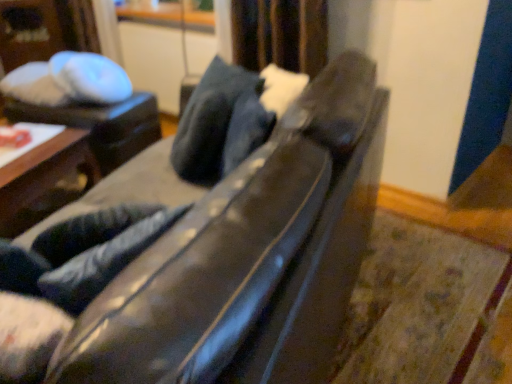
Find the location of a particular element. The image size is (512, 384). wooden table at left, which is counted as the first table, starting from the front is located at coordinates (44, 180).

What do you see at coordinates (44, 180) in the screenshot?
I see `wooden table at left, which is counted as the first table, starting from the front` at bounding box center [44, 180].

In order to face dark blue leather pillow at center, should I rotate leftwards or rightwards?

It's best to rotate left around 4.480 degrees.

In order to face white glossy table at upper left, which ranks as the 2th table in front-to-back order, should I rotate leftwards or rightwards?

Turn left approximately 21.619 degrees to face it.

Identify the location of black leather couch at center. (210, 262).

Does wooden table at left, which is counted as the first table, starting from the front, turn towards dark blue leather pillow at center?

No, wooden table at left, which is counted as the first table, starting from the front, is not facing towards dark blue leather pillow at center.

In the image, is wooden table at left, which is counted as the second table, starting from the back, on the left side or the right side of dark blue leather pillow at center?

From the image, it's evident that wooden table at left, which is counted as the second table, starting from the back, is to the left of dark blue leather pillow at center.

Considering their positions, is wooden table at left, which is counted as the first table, starting from the front, located in front of or behind dark blue leather pillow at center?

Visually, wooden table at left, which is counted as the first table, starting from the front, is located behind dark blue leather pillow at center.

Is wooden table at left, which is counted as the first table, starting from the front, turned away from satin dark blue curtain at upper center?

wooden table at left, which is counted as the first table, starting from the front, does not have its back to satin dark blue curtain at upper center.

Between wooden table at left, which is counted as the first table, starting from the front, and satin dark blue curtain at upper center, which one has more height?

Standing taller between the two is satin dark blue curtain at upper center.

From the image's perspective, between wooden table at left, which is counted as the first table, starting from the front, and satin dark blue curtain at upper center, which one is located above?

satin dark blue curtain at upper center.

Based on the photo, does wooden table at left, which is counted as the first table, starting from the front, come in front of satin dark blue curtain at upper center?

Yes, the depth of wooden table at left, which is counted as the first table, starting from the front, is less than that of satin dark blue curtain at upper center.

From the image's perspective, is satin dark blue curtain at upper center located beneath black leather couch at center?

No, from the image's perspective, satin dark blue curtain at upper center is not below black leather couch at center.

Between satin dark blue curtain at upper center and black leather couch at center, which one has larger size?

With larger size is black leather couch at center.

From a real-world perspective, is satin dark blue curtain at upper center physically located above or below black leather couch at center?

Clearly, from a real-world perspective, satin dark blue curtain at upper center is above black leather couch at center.

Is dark blue leather pillow at center smaller than satin dark blue curtain at upper center?

No, dark blue leather pillow at center is not smaller than satin dark blue curtain at upper center.

Which point is more distant from viewer, (178,135) or (303,31)?

The point (303,31) is farther from the camera.

How far apart are dark blue leather pillow at center and satin dark blue curtain at upper center?

A distance of 25.44 inches exists between dark blue leather pillow at center and satin dark blue curtain at upper center.

Consider the image. Is dark blue leather pillow at center placed right next to satin dark blue curtain at upper center?

No, dark blue leather pillow at center is not in contact with satin dark blue curtain at upper center.

Which is in front, black leather couch at center or white glossy table at upper left, the 1th table in the back-to-front sequence?

black leather couch at center is more forward.

Which of these two, black leather couch at center or white glossy table at upper left, which ranks as the 2th table in front-to-back order, stands taller?

Standing taller between the two is black leather couch at center.

Locate an element on the screen. The image size is (512, 384). studio couch that is in front of the white glossy table at upper left, the 1th table in the back-to-front sequence is located at coordinates (210, 262).

Is black leather couch at center turned away from white glossy table at upper left, which ranks as the 2th table in front-to-back order?

No.

Which is more to the left, satin dark blue curtain at upper center or wooden table at left, which is counted as the first table, starting from the front?

Positioned to the left is wooden table at left, which is counted as the first table, starting from the front.

Is satin dark blue curtain at upper center looking in the opposite direction of wooden table at left, which is counted as the first table, starting from the front?

No, wooden table at left, which is counted as the first table, starting from the front, is not at the back of satin dark blue curtain at upper center.

From a real-world perspective, is satin dark blue curtain at upper center positioned under wooden table at left, which is counted as the first table, starting from the front, based on gravity?

No.

Would you consider satin dark blue curtain at upper center to be distant from wooden table at left, which is counted as the second table, starting from the back?

satin dark blue curtain at upper center is positioned a significant distance from wooden table at left, which is counted as the second table, starting from the back.

Is white glossy table at upper left, which ranks as the 2th table in front-to-back order, smaller than black leather couch at center?

Yes.

Is white glossy table at upper left, the 1th table in the back-to-front sequence, far from black leather couch at center?

That's right, there is a large distance between white glossy table at upper left, the 1th table in the back-to-front sequence, and black leather couch at center.

From a real-world perspective, is white glossy table at upper left, the 1th table in the back-to-front sequence, on black leather couch at center?

Incorrect, from a real-world perspective, white glossy table at upper left, the 1th table in the back-to-front sequence, is lower than black leather couch at center.

Starting from the dark blue leather pillow at center, which table is the 2nd one to the left? Please provide its 2D coordinates.

[(44, 180)]

From a real-world perspective, which table is the 2nd one underneath the satin dark blue curtain at upper center? Please provide its 2D coordinates.

[(44, 180)]

From the image, which object appears to be nearer to wooden table at left, which is counted as the second table, starting from the back, white glossy table at upper left, the 1th table in the back-to-front sequence, or satin dark blue curtain at upper center?

white glossy table at upper left, the 1th table in the back-to-front sequence.

Considering their positions, is satin dark blue curtain at upper center positioned further to black leather couch at center than wooden table at left, which is counted as the first table, starting from the front?

wooden table at left, which is counted as the first table, starting from the front, is further to black leather couch at center.

Estimate the real-world distances between objects in this image. Which object is closer to dark blue leather pillow at center, wooden table at left, which is counted as the first table, starting from the front, or black leather couch at center?

Among the two, black leather couch at center is located nearer to dark blue leather pillow at center.

Based on their spatial positions, is wooden table at left, which is counted as the first table, starting from the front, or satin dark blue curtain at upper center closer to white glossy table at upper left, which ranks as the 2th table in front-to-back order?

Among the two, wooden table at left, which is counted as the first table, starting from the front, is located nearer to white glossy table at upper left, which ranks as the 2th table in front-to-back order.

Consider the image. Looking at the image, which one is located closer to dark blue leather pillow at center, satin dark blue curtain at upper center or white glossy table at upper left, which ranks as the 2th table in front-to-back order?

satin dark blue curtain at upper center is positioned closer to the anchor dark blue leather pillow at center.

From the picture: Which object lies nearer to the anchor point white glossy table at upper left, which ranks as the 2th table in front-to-back order, satin dark blue curtain at upper center or black leather couch at center?

Based on the image, satin dark blue curtain at upper center appears to be nearer to white glossy table at upper left, which ranks as the 2th table in front-to-back order.

Looking at the image, which one is located further to white glossy table at upper left, which ranks as the 2th table in front-to-back order, black leather couch at center or satin dark blue curtain at upper center?

black leather couch at center is further to white glossy table at upper left, which ranks as the 2th table in front-to-back order.

Looking at this image, which object lies nearer to the anchor point white glossy table at upper left, which ranks as the 2th table in front-to-back order, black leather couch at center or wooden table at left, which is counted as the first table, starting from the front?

wooden table at left, which is counted as the first table, starting from the front.

You are a GUI agent. You are given a task and a screenshot of the screen. Output one action in this format:
    pyautogui.click(x=<x>, y=<y>)
    Task: Click on the pillow between black leather couch at center and white glossy table at upper left, the 1th table in the back-to-front sequence, along the z-axis
    Image resolution: width=512 pixels, height=384 pixels.
    Given the screenshot: What is the action you would take?
    pyautogui.click(x=220, y=124)

What are the coordinates of `table between black leather couch at center and white glossy table at upper left, which ranks as the 2th table in front-to-back order, in the front-back direction` in the screenshot? It's located at (44, 180).

This screenshot has width=512, height=384. In order to click on table between wooden table at left, which is counted as the second table, starting from the back, and dark blue leather pillow at center from left to right in this screenshot , I will do `click(101, 125)`.

This screenshot has height=384, width=512. I want to click on pillow between wooden table at left, which is counted as the first table, starting from the front, and satin dark blue curtain at upper center, so [x=220, y=124].